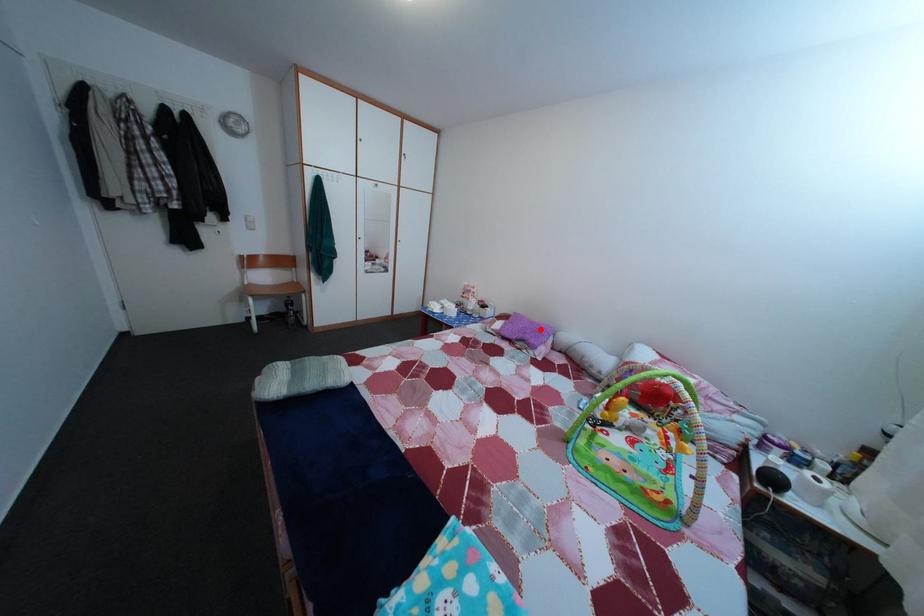
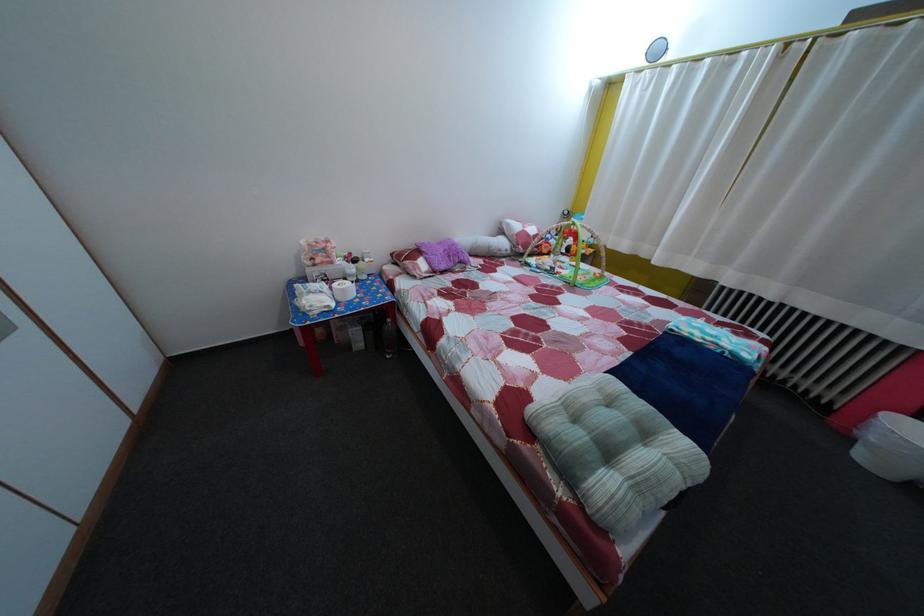
Find the pixel in the second image that matches the highlighted location in the first image.

(450, 252)